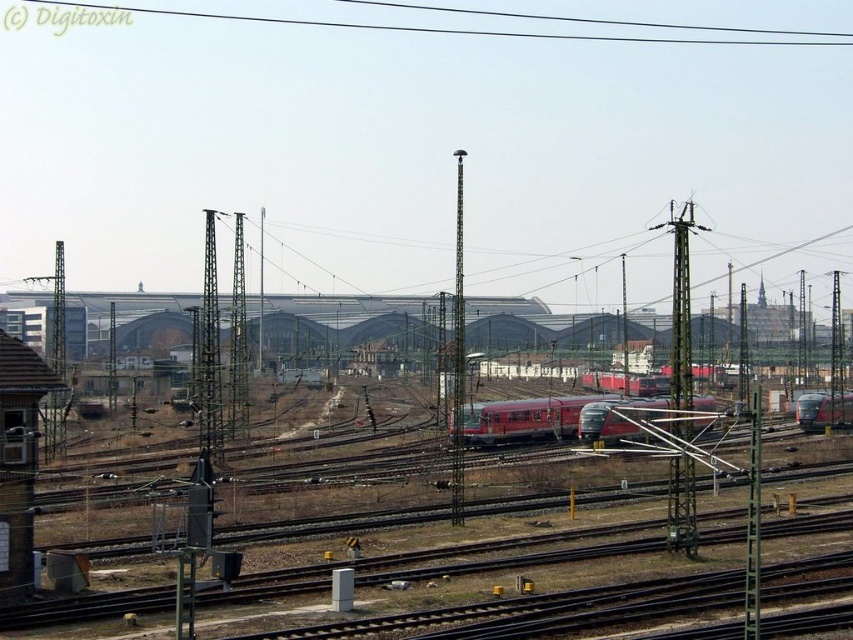
Is point (136, 6) less distant than point (461, 243)?

No, it is behind (461, 243).

Can you confirm if black wire at upper center is thinner than metallic pole at center?

Incorrect, black wire at upper center's width is not less than metallic pole at center's.

Which is in front, point (538, 16) or point (459, 468)?

Point (459, 468) is more forward.

Where is `black wire at upper center`? black wire at upper center is located at coordinates (437, 28).

Looking at this image, between red metallic train at center and black wire at upper center, which one appears on the left side from the viewer's perspective?

Positioned to the left is black wire at upper center.

Which is behind, point (468, 422) or point (413, 32)?

The point (413, 32) is more distant.

Is point (619, 403) closer to viewer compared to point (302, 20)?

That is True.

Where is `red metallic train at center`? The width and height of the screenshot is (853, 640). red metallic train at center is located at coordinates (560, 419).

Between red metallic train at center and red metallic train at right, which one is positioned lower?

Positioned lower is red metallic train at right.

Is the position of red metallic train at center less distant than that of red metallic train at right?

Yes, it is.

Is point (608, 400) positioned before point (813, 412)?

That is True.

Image resolution: width=853 pixels, height=640 pixels. Find the location of `red metallic train at center`. red metallic train at center is located at coordinates (560, 419).